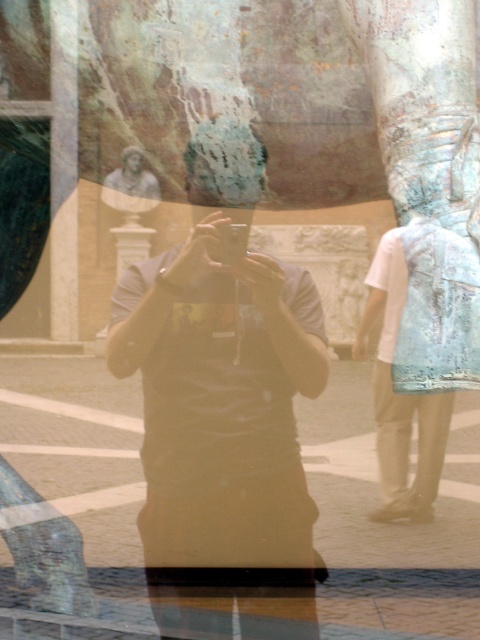
Question: Among these objects, which one is farthest from the camera?

Choices:
 (A) light blue fabric shirt at right
 (B) matte black t-shirt at center

Answer: (B)

Question: Does matte black t-shirt at center have a larger size compared to light blue fabric shirt at right?

Choices:
 (A) yes
 (B) no

Answer: (A)

Question: Is matte black t-shirt at center to the right of light blue fabric shirt at right from the viewer's perspective?

Choices:
 (A) no
 (B) yes

Answer: (A)

Question: Is the position of matte black t-shirt at center less distant than that of light blue fabric shirt at right?

Choices:
 (A) no
 (B) yes

Answer: (A)

Question: Among these points, which one is farthest from the camera?

Choices:
 (A) (271, 480)
 (B) (408, 429)

Answer: (B)